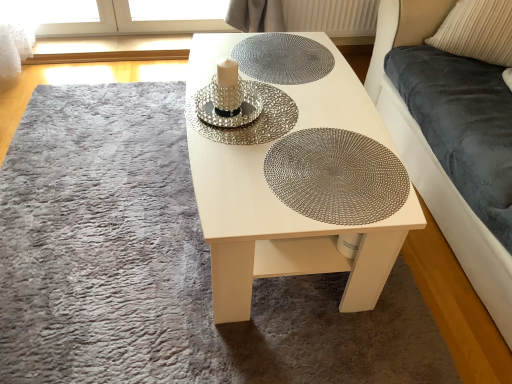
Question: Is white wood table at center to the right of beige corduroy pillow at upper right from the viewer's perspective?

Choices:
 (A) no
 (B) yes

Answer: (A)

Question: Considering the relative positions of white wood table at center and beige corduroy pillow at upper right in the image provided, is white wood table at center behind beige corduroy pillow at upper right?

Choices:
 (A) yes
 (B) no

Answer: (B)

Question: Is white wood table at center shorter than beige corduroy pillow at upper right?

Choices:
 (A) no
 (B) yes

Answer: (A)

Question: Is white wood table at center to the left of beige corduroy pillow at upper right from the viewer's perspective?

Choices:
 (A) yes
 (B) no

Answer: (A)

Question: From a real-world perspective, is white wood table at center physically above beige corduroy pillow at upper right?

Choices:
 (A) yes
 (B) no

Answer: (B)

Question: Is velvet dark blue couch at right taller or shorter than white textured radiator at upper center?

Choices:
 (A) short
 (B) tall

Answer: (B)

Question: Is point coord(455,213) positioned closer to the camera than point coord(338,29)?

Choices:
 (A) closer
 (B) farther

Answer: (A)

Question: Is velvet dark blue couch at right bigger or smaller than white textured radiator at upper center?

Choices:
 (A) small
 (B) big

Answer: (B)

Question: Is velvet dark blue couch at right in front of or behind white textured radiator at upper center in the image?

Choices:
 (A) front
 (B) behind

Answer: (A)

Question: Does point (332, 173) appear closer or farther from the camera than point (328, 258)?

Choices:
 (A) farther
 (B) closer

Answer: (B)

Question: Based on their sizes in the image, would you say metallic woven placemat at center, marked as the 1th glass plate in a bottom-to-top arrangement, is bigger or smaller than white wood table at center?

Choices:
 (A) small
 (B) big

Answer: (A)

Question: In terms of width, does metallic woven placemat at center, marked as the 1th glass plate in a bottom-to-top arrangement, look wider or thinner when compared to white wood table at center?

Choices:
 (A) wide
 (B) thin

Answer: (B)

Question: Considering their positions, is metallic woven placemat at center, placed as the third glass plate when sorted from top to bottom, located in front of or behind white wood table at center?

Choices:
 (A) behind
 (B) front

Answer: (A)

Question: Considering the positions of white textured radiator at upper center and velvet dark blue couch at right in the image, is white textured radiator at upper center taller or shorter than velvet dark blue couch at right?

Choices:
 (A) short
 (B) tall

Answer: (A)

Question: Looking at their shapes, would you say white textured radiator at upper center is wider or thinner than velvet dark blue couch at right?

Choices:
 (A) wide
 (B) thin

Answer: (B)